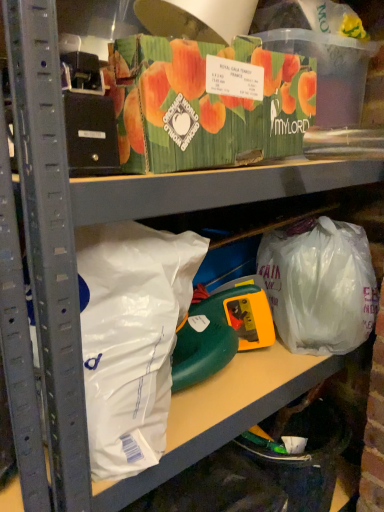
Question: Does white matte plastic bag at left, positioned as the second plastic bag in right-to-left order, turn towards translucent plastic bag at lower right, the first plastic bag when ordered from right to left?

Choices:
 (A) no
 (B) yes

Answer: (A)

Question: Is the position of white matte plastic bag at left, which is counted as the first plastic bag, starting from the left, less distant than that of translucent plastic bag at lower right, the second plastic bag viewed from the front?

Choices:
 (A) yes
 (B) no

Answer: (A)

Question: Are white matte plastic bag at left, positioned as the second plastic bag in back-to-front order, and translucent plastic bag at lower right, the second plastic bag viewed from the front, beside each other?

Choices:
 (A) yes
 (B) no

Answer: (B)

Question: Is white matte plastic bag at left, positioned as the second plastic bag in back-to-front order, oriented away from translucent plastic bag at lower right, arranged as the second plastic bag when viewed from the left?

Choices:
 (A) yes
 (B) no

Answer: (B)

Question: Is white matte plastic bag at left, positioned as the second plastic bag in back-to-front order, shorter than translucent plastic bag at lower right, the first plastic bag when ordered from back to front?

Choices:
 (A) yes
 (B) no

Answer: (B)

Question: Would you consider white matte plastic bag at left, positioned as the second plastic bag in right-to-left order, to be distant from translucent plastic bag at lower right, the second plastic bag viewed from the front?

Choices:
 (A) yes
 (B) no

Answer: (B)

Question: Is translucent plastic bag at lower right, the second plastic bag viewed from the front, further to the viewer compared to white matte plastic bag at left, positioned as the second plastic bag in back-to-front order?

Choices:
 (A) yes
 (B) no

Answer: (A)

Question: From a real-world perspective, is translucent plastic bag at lower right, arranged as the second plastic bag when viewed from the left, located higher than white matte plastic bag at left, the 1th plastic bag positioned from the front?

Choices:
 (A) no
 (B) yes

Answer: (A)

Question: From the image's perspective, is translucent plastic bag at lower right, the second plastic bag viewed from the front, located above white matte plastic bag at left, the 1th plastic bag positioned from the front?

Choices:
 (A) no
 (B) yes

Answer: (B)

Question: Is translucent plastic bag at lower right, the second plastic bag viewed from the front, at the left side of white matte plastic bag at left, positioned as the second plastic bag in right-to-left order?

Choices:
 (A) no
 (B) yes

Answer: (A)

Question: Is translucent plastic bag at lower right, the second plastic bag viewed from the front, facing away from white matte plastic bag at left, which is counted as the first plastic bag, starting from the left?

Choices:
 (A) yes
 (B) no

Answer: (B)

Question: Is translucent plastic bag at lower right, the first plastic bag when ordered from right to left, in contact with white matte plastic bag at left, which is counted as the first plastic bag, starting from the left?

Choices:
 (A) no
 (B) yes

Answer: (A)

Question: In terms of height, does white matte plastic bag at left, positioned as the second plastic bag in back-to-front order, look taller or shorter compared to translucent plastic bag at lower right, the first plastic bag when ordered from right to left?

Choices:
 (A) tall
 (B) short

Answer: (A)